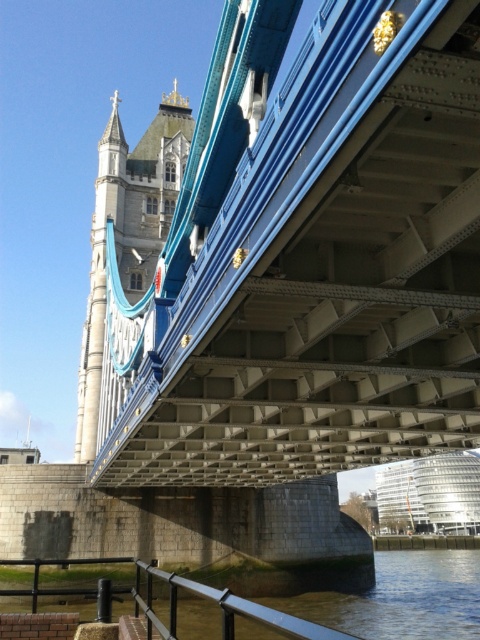
You are a tourist standing on the walkway of the Tower Bridge in London. You notice the metallic blue suspension bridge at center and the stone tower at upper left. Which object is located below the other?

The metallic blue suspension bridge at center is positioned under the stone tower at upper left.

You are standing on the walkway of the Tower Bridge and want to take a photo of both the metallic blue suspension bridge at center and the stone tower at upper left. Which object should you focus on first to ensure both are in the frame?

You should focus on the metallic blue suspension bridge at center first since it is closer to you than the stone tower at upper left, ensuring both are in the frame.

You are a photographer planning to capture the metallic blue suspension bridge at center and the stone tower at upper left in a single shot. Based on their sizes, which object would likely occupy more of the frame?

The metallic blue suspension bridge at center might occupy more of the frame since it is wider than the stone tower at upper left according to the description.